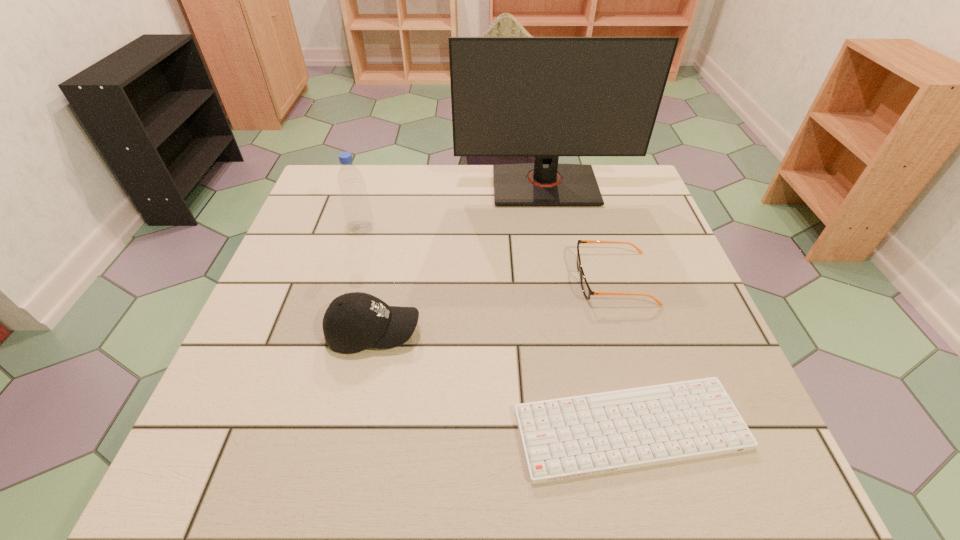
Where is `free area in between the computer keyboard and the third farthest object`? Image resolution: width=960 pixels, height=540 pixels. free area in between the computer keyboard and the third farthest object is located at coordinates (622, 354).

What are the coordinates of `empty location between the nearest object and the fourth tallest object` in the screenshot? It's located at (622, 354).

Find the location of `vacant space in between the spectacles and the tallest object`. vacant space in between the spectacles and the tallest object is located at coordinates click(580, 232).

In order to click on object that can be found as the second closest to the shortest object in this screenshot , I will do `click(353, 322)`.

Choose which object is the third nearest neighbor to the second nearest object. Please provide its 2D coordinates. Your answer should be formatted as a tuple, i.e. [(x, y)], where the tuple contains the x and y coordinates of a point satisfying the conditions above.

[(587, 291)]

The height and width of the screenshot is (540, 960). What are the coordinates of `free location that satisfies the following two spatial constraints: 1. on the front-facing side of the third shortest object; 2. on the left side of the nearest object` in the screenshot? It's located at (353, 429).

Where is `free location that satisfies the following two spatial constraints: 1. on the screen side of the monitor; 2. on the front-facing side of the fourth farthest object`? This screenshot has height=540, width=960. free location that satisfies the following two spatial constraints: 1. on the screen side of the monitor; 2. on the front-facing side of the fourth farthest object is located at coordinates (572, 333).

Where is `free space in the image that satisfies the following two spatial constraints: 1. on the screen side of the shortest object; 2. on the left side of the tallest object`? The height and width of the screenshot is (540, 960). free space in the image that satisfies the following two spatial constraints: 1. on the screen side of the shortest object; 2. on the left side of the tallest object is located at coordinates (590, 429).